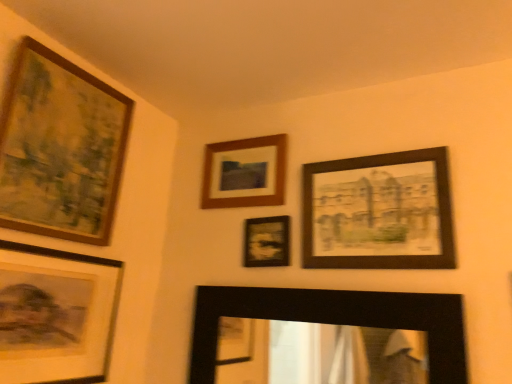
Question: Is wooden-framed painting at upper left, arranged as the 1th picture frame when viewed from the left, thinner than matte black picture frame at center, positioned as the fourth picture frame in left-to-right order?

Choices:
 (A) yes
 (B) no

Answer: (B)

Question: Is wooden-framed painting at upper left, the 6th picture frame from the right, positioned before matte black picture frame at center, positioned as the fourth picture frame in left-to-right order?

Choices:
 (A) no
 (B) yes

Answer: (B)

Question: From a real-world perspective, is wooden-framed painting at upper left, the 6th picture frame from the right, on matte black picture frame at center, placed as the third picture frame when sorted from right to left?

Choices:
 (A) yes
 (B) no

Answer: (A)

Question: Considering the relative sizes of wooden-framed painting at upper left, the 6th picture frame from the right, and matte black picture frame at center, placed as the third picture frame when sorted from right to left, in the image provided, is wooden-framed painting at upper left, the 6th picture frame from the right, taller than matte black picture frame at center, placed as the third picture frame when sorted from right to left,?

Choices:
 (A) no
 (B) yes

Answer: (B)

Question: Is wooden-framed painting at upper left, arranged as the 1th picture frame when viewed from the left, aimed at matte black picture frame at center, positioned as the fourth picture frame in left-to-right order?

Choices:
 (A) no
 (B) yes

Answer: (A)

Question: Can you confirm if wooden-framed painting at upper left, the 6th picture frame from the right, is smaller than matte black picture frame at center, placed as the third picture frame when sorted from right to left?

Choices:
 (A) yes
 (B) no

Answer: (B)

Question: From the image's perspective, is wooden frame at upper center, which is the 3th picture frame in left-to-right order, located beneath wooden-framed painting at upper left, arranged as the 1th picture frame when viewed from the left?

Choices:
 (A) no
 (B) yes

Answer: (B)

Question: From the image's perspective, is wooden frame at upper center, which is the 4th picture frame in right-to-left order, located above wooden-framed painting at upper left, the 6th picture frame from the right?

Choices:
 (A) yes
 (B) no

Answer: (B)

Question: From a real-world perspective, is wooden frame at upper center, which is the 4th picture frame in right-to-left order, physically below wooden-framed painting at upper left, the 6th picture frame from the right?

Choices:
 (A) no
 (B) yes

Answer: (A)

Question: Considering the relative sizes of wooden frame at upper center, which is the 3th picture frame in left-to-right order, and wooden-framed painting at upper left, the 6th picture frame from the right, in the image provided, is wooden frame at upper center, which is the 3th picture frame in left-to-right order, bigger than wooden-framed painting at upper left, the 6th picture frame from the right,?

Choices:
 (A) yes
 (B) no

Answer: (B)

Question: Is wooden frame at upper center, which is the 3th picture frame in left-to-right order, completely or partially outside of wooden-framed painting at upper left, the 6th picture frame from the right?

Choices:
 (A) yes
 (B) no

Answer: (A)

Question: Is wooden frame at upper center, which is the 4th picture frame in right-to-left order, positioned before wooden-framed painting at upper left, the 6th picture frame from the right?

Choices:
 (A) no
 (B) yes

Answer: (A)

Question: Is black matte mirror at lower center, the 2th picture frame when ordered from right to left, oriented towards matte black picture frame at center, placed as the third picture frame when sorted from right to left?

Choices:
 (A) no
 (B) yes

Answer: (A)